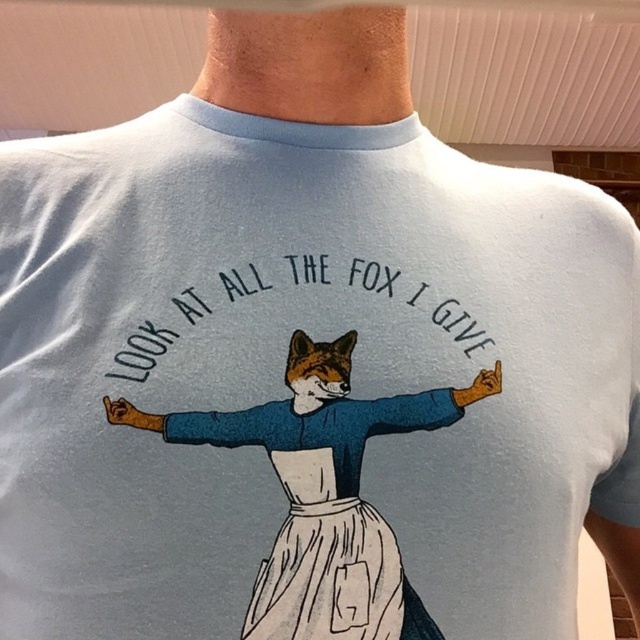
Measure the distance between white cotton dress at center and blue fabric arm at center.

white cotton dress at center is 1.30 inches from blue fabric arm at center.

Is white cotton dress at center shorter than blue fabric arm at center?

No.

Between point (332, 621) and point (243, 436), which one is positioned in front?

Point (332, 621) is more forward.

You are a GUI agent. You are given a task and a screenshot of the screen. Output one action in this format:
    pyautogui.click(x=<x>, y=<y>)
    Task: Click on the white cotton dress at center
    
    Given the screenshot: What is the action you would take?
    pyautogui.click(x=326, y=515)

Between white cotton dress at center and matte blue arm at center, which one has less height?

matte blue arm at center

At what (x,y) coordinates should I click in order to perform the action: click on white cotton dress at center. Please return your answer as a coordinate pair (x, y). This screenshot has width=640, height=640. Looking at the image, I should click on (326, 515).

Is blue fabric arm at center to the right of matte blue arm at center from the viewer's perspective?

In fact, blue fabric arm at center is to the left of matte blue arm at center.

Is blue fabric arm at center wider than matte blue arm at center?

Indeed, blue fabric arm at center has a greater width compared to matte blue arm at center.

Which is behind, point (116, 422) or point (461, 410)?

The point (461, 410) is behind.

Find the location of a particular element. The width and height of the screenshot is (640, 640). blue fabric arm at center is located at coordinates (205, 424).